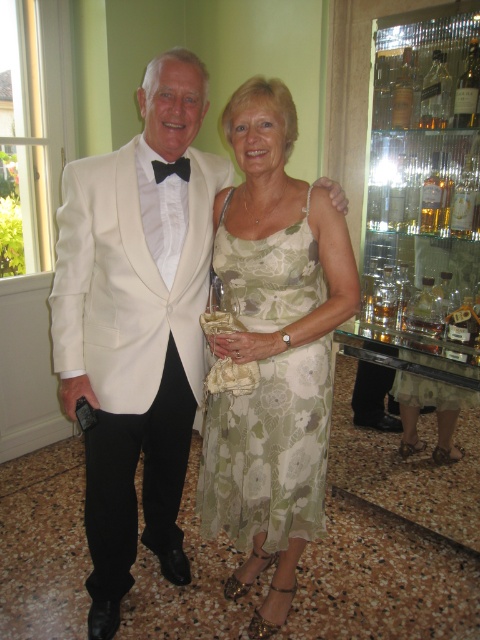
You are a photographer at a formal event. You need to capture a photo of both the white satin tuxedo at center and the green floral fabric dress at center. Based on their positions, which one is more likely to be on the left side of the photo?

The white satin tuxedo at center is more likely to be on the left side of the photo since the man is described as standing on the left in the scene.

You are a photographer at a formal event. You need to capture a closeup shot of the white satin tuxedo at center. Where exactly should you focus your camera?

You should focus your camera at point [136,323] to capture the white satin tuxedo at center.